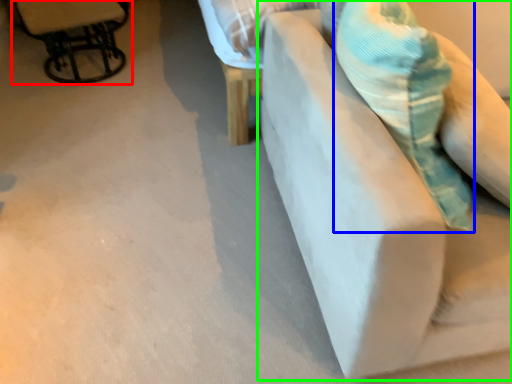
Question: Based on their relative distances, which object is farther from chair (highlighted by a red box)? Choose from throw pillow (highlighted by a blue box) and furniture (highlighted by a green box).

Choices:
 (A) throw pillow
 (B) furniture

Answer: (A)